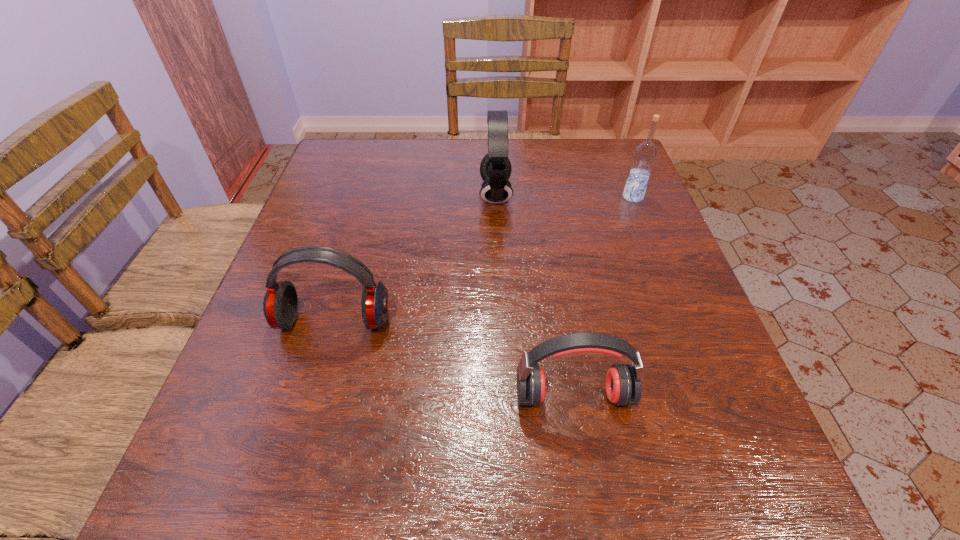
Locate an element on the screen. This screenshot has width=960, height=540. vacant region located on the ear cups of the nearest earphone is located at coordinates (586, 470).

The width and height of the screenshot is (960, 540). I want to click on object present at the far edge, so click(x=495, y=169).

You are a GUI agent. You are given a task and a screenshot of the screen. Output one action in this format:
    pyautogui.click(x=<x>, y=<y>)
    Task: Click on the object that is at the left edge
    
    Given the screenshot: What is the action you would take?
    pyautogui.click(x=280, y=305)

Locate an element on the screen. This screenshot has height=540, width=960. object located at the right edge is located at coordinates (645, 154).

At what (x,y) coordinates should I click in order to perform the action: click on vacant point at the far edge. Please return your answer as a coordinate pair (x, y). This screenshot has width=960, height=540. Looking at the image, I should click on (536, 174).

Locate an element on the screen. vacant region at the near edge of the desktop is located at coordinates (545, 472).

In the image, there is a desktop. Where is `free space at the left edge`? The height and width of the screenshot is (540, 960). free space at the left edge is located at coordinates (324, 190).

This screenshot has width=960, height=540. In order to click on vacant space at the right edge of the desktop in this screenshot , I will do `click(673, 451)`.

In the image, there is a desktop. Where is `free space at the far left corner`? free space at the far left corner is located at coordinates (354, 162).

You are a GUI agent. You are given a task and a screenshot of the screen. Output one action in this format:
    pyautogui.click(x=<x>, y=<y>)
    Task: Click on the vacant space at the near left corner
    The image size is (960, 540).
    Given the screenshot: What is the action you would take?
    pos(187,506)